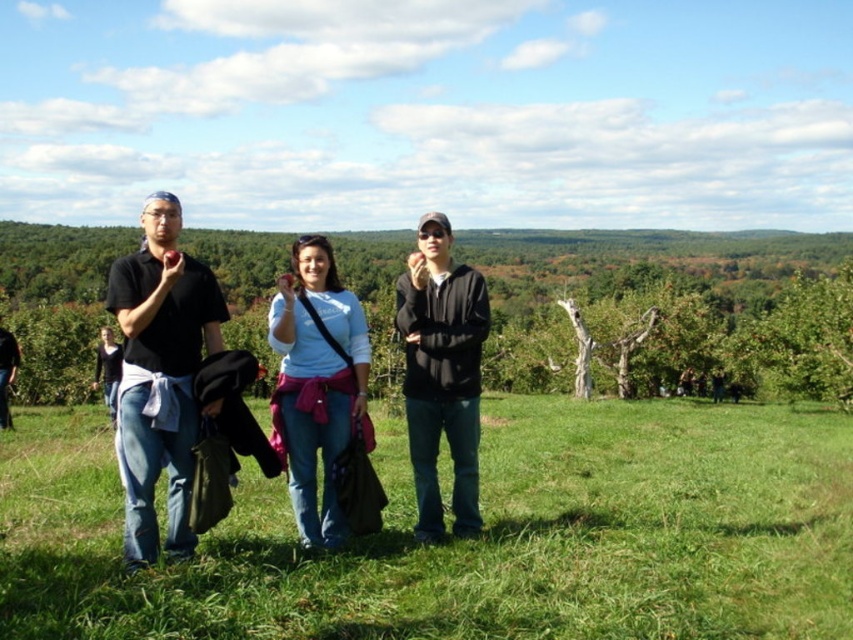
You are planning to take a photo of the two people in the middle of the group. The light blue cotton shirt at center and the black matte jacket at center are overlapping. Which clothing item is smaller and would be easier to frame in the photo without obstruction?

The light blue cotton shirt at center is smaller than the black matte jacket at center, so it would be easier to frame in the photo without obstruction.

You are a photographer trying to capture a photo of the matte black shirt at left and the green grassy field at center. Which object is taller when viewed from the front?

The matte black shirt at left is taller than the green grassy field at center.